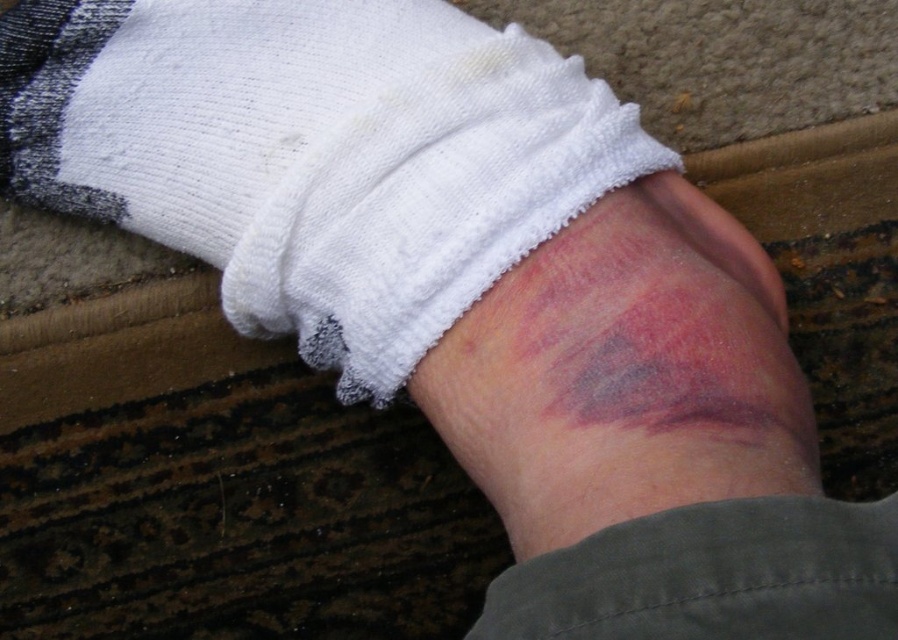
Question: Which of the following is the closest to the observer?

Choices:
 (A) (578, 472)
 (B) (262, 212)

Answer: (A)

Question: Does white terry cloth sock at center have a greater width compared to purple bruised skin at center?

Choices:
 (A) yes
 (B) no

Answer: (A)

Question: Which of the following is the closest to the observer?

Choices:
 (A) purple bruised skin at center
 (B) white terry cloth sock at center

Answer: (A)

Question: Does white terry cloth sock at center appear on the left side of purple bruised skin at center?

Choices:
 (A) no
 (B) yes

Answer: (B)

Question: Where is white terry cloth sock at center located in relation to purple bruised skin at center in the image?

Choices:
 (A) right
 (B) left

Answer: (B)

Question: Which of the following is the closest to the observer?

Choices:
 (A) 542,248
 (B) 251,184

Answer: (A)